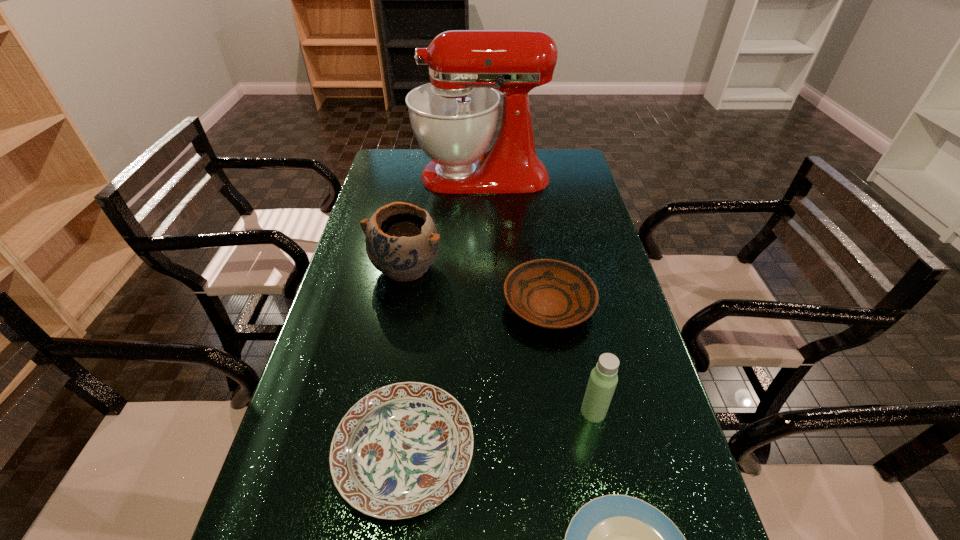
Where is `thermos bottle present at the right edge`? The height and width of the screenshot is (540, 960). thermos bottle present at the right edge is located at coordinates (603, 379).

At what (x,y) coordinates should I click in order to perform the action: click on plate that is at the right edge. Please return your answer as a coordinate pair (x, y). This screenshot has width=960, height=540. Looking at the image, I should click on (548, 293).

At what (x,y) coordinates should I click in order to perform the action: click on object located at the far left corner. Please return your answer as a coordinate pair (x, y). The width and height of the screenshot is (960, 540). Looking at the image, I should click on (454, 117).

This screenshot has width=960, height=540. Identify the location of object that is at the far right corner. (454, 117).

This screenshot has height=540, width=960. In the image, there is a desktop. Find the location of `free space at the left edge`. free space at the left edge is located at coordinates (374, 201).

This screenshot has height=540, width=960. I want to click on vacant space at the right edge of the desktop, so click(597, 268).

At what (x,y) coordinates should I click in order to perform the action: click on vacant space at the far right corner. Please return your answer as a coordinate pair (x, y). The image size is (960, 540). Looking at the image, I should click on (571, 164).

Find the location of a particular element. vacant space that's between the tallest object and the pottery is located at coordinates (444, 222).

Locate an element on the screen. vacant area that lies between the third shortest object and the farthest object is located at coordinates (516, 240).

Identify the location of empty space that is in between the leftmost plate and the farthest object. This screenshot has width=960, height=540. (444, 315).